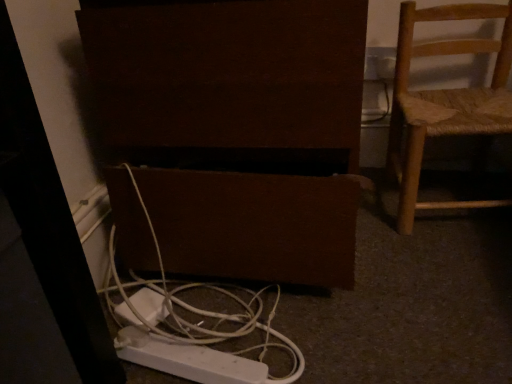
Question: In terms of height, does white plastic outlet at upper right look taller or shorter compared to brown matte speaker at lower center?

Choices:
 (A) tall
 (B) short

Answer: (B)

Question: From the image's perspective, is white plastic outlet at upper right above or below brown matte speaker at lower center?

Choices:
 (A) below
 (B) above

Answer: (B)

Question: Which object is the farthest from the brown matte speaker at lower center?

Choices:
 (A) white plastic outlet at upper right
 (B) woven wood chair at right
 (C) white plastic cable at lower center

Answer: (A)

Question: Estimate the real-world distances between objects in this image. Which object is closer to the white plastic outlet at upper right?

Choices:
 (A) brown matte speaker at lower center
 (B) white plastic cable at lower center
 (C) woven wood chair at right

Answer: (C)